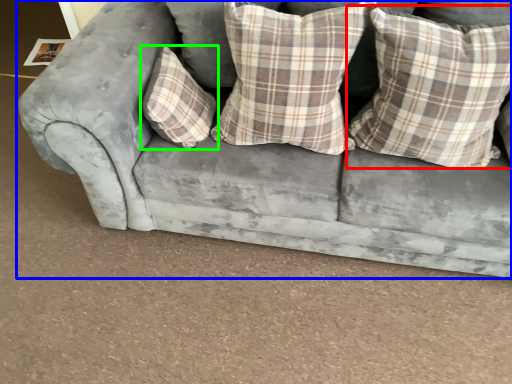
Question: Based on their relative distances, which object is farther from pillow (highlighted by a red box)? Choose from studio couch (highlighted by a blue box) and pillow (highlighted by a green box).

Choices:
 (A) studio couch
 (B) pillow

Answer: (B)